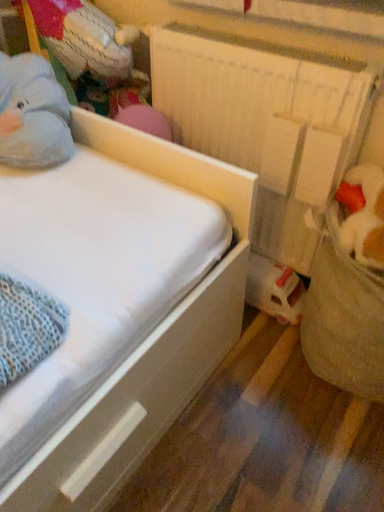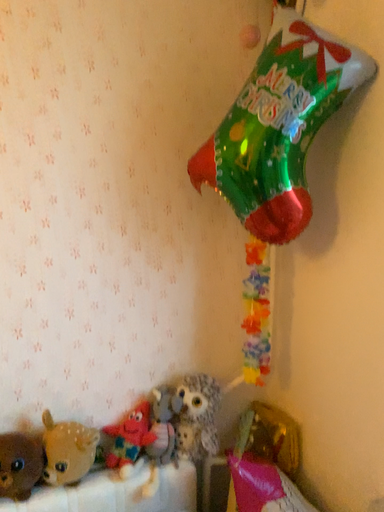
Question: How did the camera likely rotate when shooting the video?

Choices:
 (A) rotated upward
 (B) rotated downward

Answer: (A)